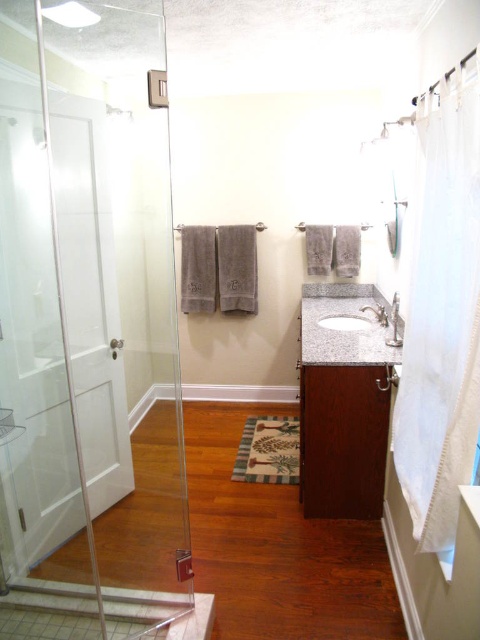
You are a home inspector assessing the bathroom layout. You need to determine if the dark wood cabinet at center can be accessed without moving the transparent glass shower door at left. Based on their positions, what is your conclusion?

The transparent glass shower door at left is in front of the dark wood cabinet at center, so you would need to move the shower door to access the cabinet.

In the scene shown: You are standing in the bathroom and want to reach both point (144, 157) and point (367, 324). Which point should you approach first to minimize the total distance traveled?

You should approach point (144, 157) first because it is closer to you than point (367, 324), so reaching it first minimizes the total distance traveled.